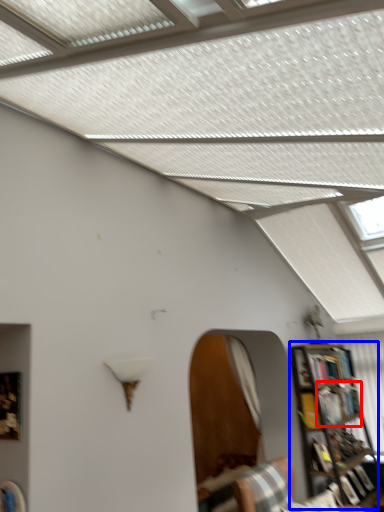
Question: Among these objects, which one is farthest to the camera, book (highlighted by a red box) or bookcase (highlighted by a blue box)?

Choices:
 (A) book
 (B) bookcase

Answer: (A)